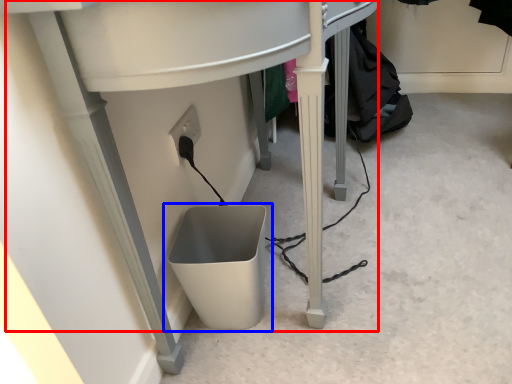
Question: Which point is closer to the camera, computer desk (highlighted by a red box) or waste container (highlighted by a blue box)?

Choices:
 (A) computer desk
 (B) waste container

Answer: (A)